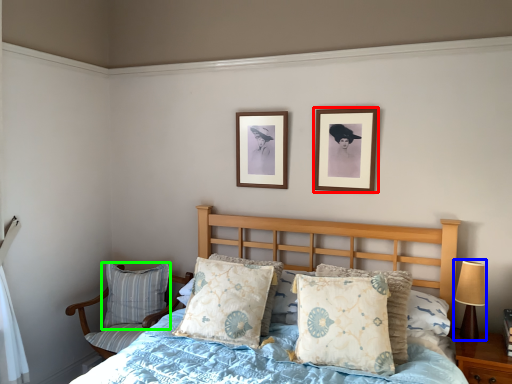
Question: Which object is the farthest from picture frame (highlighted by a red box)? Choose among these: table lamp (highlighted by a blue box) or pillow (highlighted by a green box).

Choices:
 (A) table lamp
 (B) pillow

Answer: (B)